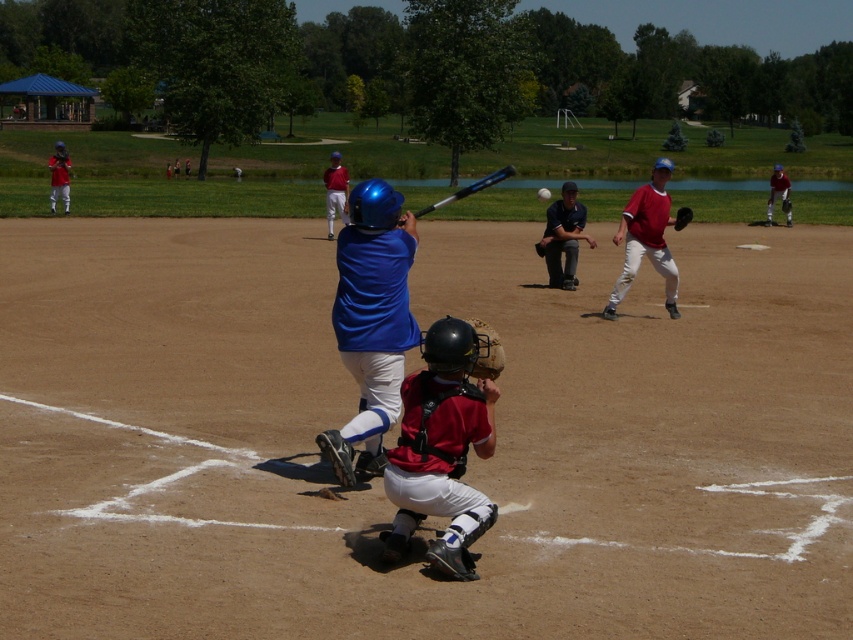
Question: Can you confirm if matte blue helmet at upper center is thinner than brown leather glove at center?

Choices:
 (A) no
 (B) yes

Answer: (A)

Question: Can you confirm if shiny blue bat at center is thinner than matte red baseball glove at right?

Choices:
 (A) no
 (B) yes

Answer: (B)

Question: Among these points, which one is farthest from the camera?

Choices:
 (A) (329, 232)
 (B) (59, 168)
 (C) (541, 252)
 (D) (500, 179)

Answer: (D)

Question: Which object is farther from the camera taking this photo?

Choices:
 (A) shiny blue bat at center
 (B) red matte uniform at center

Answer: (A)

Question: Can you confirm if shiny blue bat at center is positioned to the left of white matte baseball at center?

Choices:
 (A) no
 (B) yes

Answer: (B)

Question: Which of these objects is positioned farthest from the red matte uniform at center?

Choices:
 (A) matte red baseball glove at right
 (B) red matte baseball glove at center
 (C) matte blue helmet at center
 (D) dark blue uniform at center

Answer: (A)